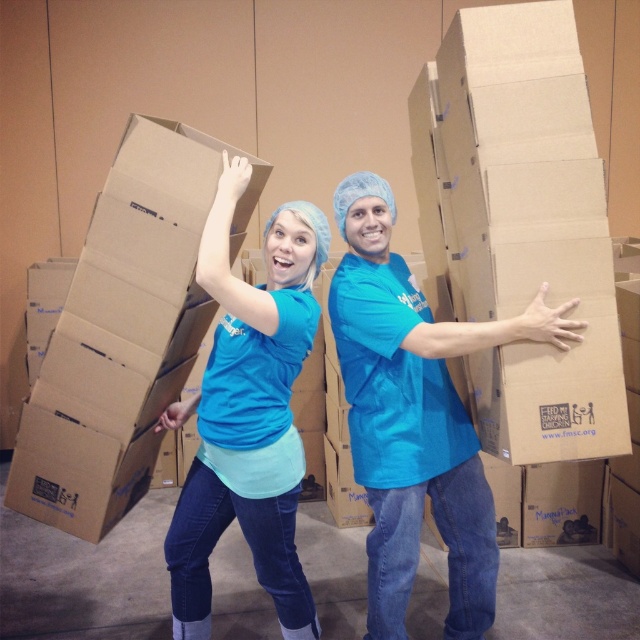
In the scene shown: You are a volunteer at the FEED MY STARVING CHILDREN event and need to place a new box on top of the brown cardboard box at upper left. The new box is the same size as the matte blue shirt at center. Will the new box fit on top?

The brown cardboard box at upper left is shorter than the matte blue shirt at center. Since the new box is the same size as the matte blue shirt at center, it will be taller than the brown cardboard box at upper left. Therefore, the new box may not fit stably on top of the brown cardboard box at upper left due to its height difference.

You are a delivery person who needs to place a new box at the same location as the brown cardboard box at upper left. What coordinates should you use?

The coordinates for the brown cardboard box at upper left are at point (x=124, y=330).

You are standing in a room with a brown cardboard box at upper left. You want to reach it without moving your feet. Can you do it?

The brown cardboard box at upper left is 1.72 meters away from viewer, so you can reach it without moving your feet if your arm length plus height is at least 1.72 meters.